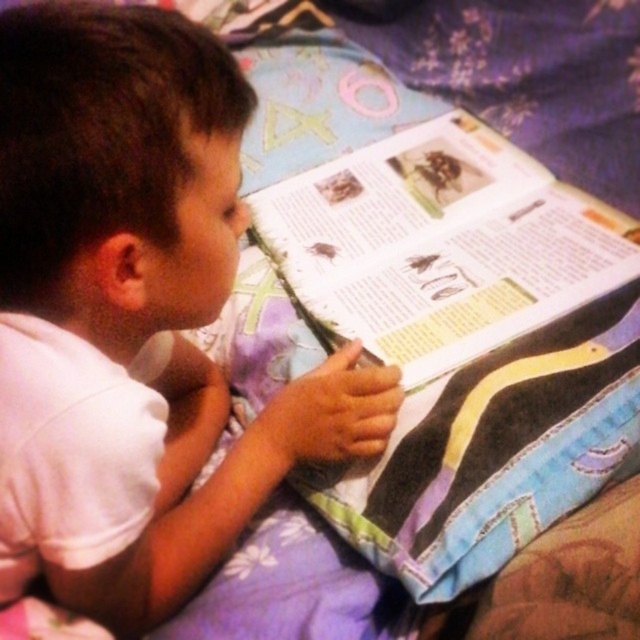
You are a photographer trying to capture a candid shot of the child reading. You notice the white matte shirt at upper left and the camera. How far apart are they?

The white matte shirt at upper left and the camera are 17.53 inches apart from each other.

You are a photographer trying to capture the scene of the child reading. You notice the white matte shirt at upper left and the paperback book at center. Which object is closer to the camera? Explain your reasoning based on their positions.

The white matte shirt at upper left is positioned under the paperback book at center, meaning the paperback book at center is closer to the camera. Objects that are positioned above others in the image typically indicate they are nearer to the viewer.

You are a tailor who needs to know the relative thickness of the white matte shirt at upper left and the paperback book at center to decide which one can fit into a narrow storage box. Based on the scene, which item is thinner?

The white matte shirt at upper left is thinner than the paperback book at center, so it can fit into the narrow storage box.